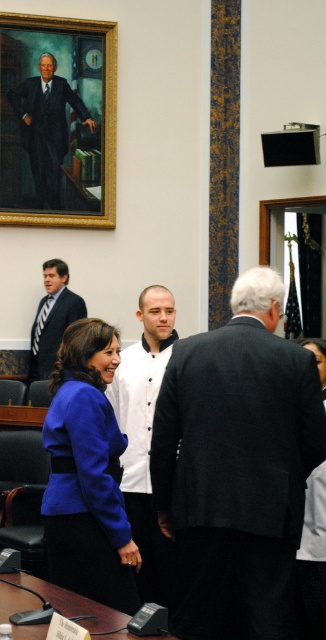
Is blue woolen jacket at center bigger than dark blue matte business suit at upper left?

Indeed, blue woolen jacket at center has a larger size compared to dark blue matte business suit at upper left.

Is point (86, 349) more distant than point (26, 129)?

No, it is in front of (26, 129).

Locate an element on the screen. Image resolution: width=326 pixels, height=640 pixels. blue woolen jacket at center is located at coordinates (87, 474).

Does black textured suit at center appear on the right side of white matte shirt at center?

Indeed, black textured suit at center is positioned on the right side of white matte shirt at center.

Can you confirm if black textured suit at center is bigger than white matte shirt at center?

Yes.

Does point (206, 340) lie in front of point (152, 588)?

Yes, point (206, 340) is in front of point (152, 588).

What are the coordinates of `black textured suit at center` in the screenshot? It's located at (237, 464).

Is black textured suit at center to the right of dark blue matte business suit at upper left from the viewer's perspective?

Indeed, black textured suit at center is positioned on the right side of dark blue matte business suit at upper left.

This screenshot has height=640, width=326. What do you see at coordinates (237, 464) in the screenshot? I see `black textured suit at center` at bounding box center [237, 464].

I want to click on black textured suit at center, so click(x=237, y=464).